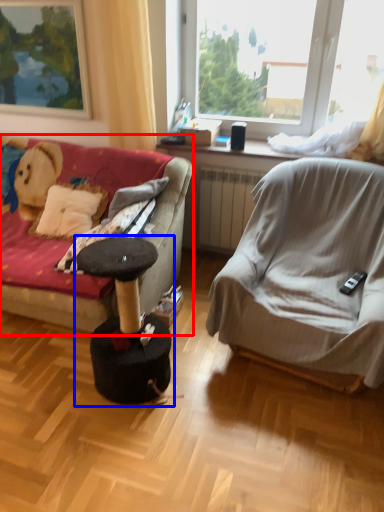
Question: Which object appears farthest to the camera in this image, studio couch (highlighted by a red box) or music stool (highlighted by a blue box)?

Choices:
 (A) studio couch
 (B) music stool

Answer: (A)